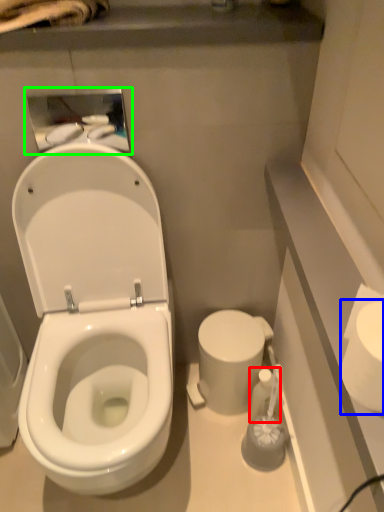
Question: Which is farther away from toiletry (highlighted by a red box)? toilet paper (highlighted by a blue box) or medicine cabinet (highlighted by a green box)?

Choices:
 (A) toilet paper
 (B) medicine cabinet

Answer: (B)